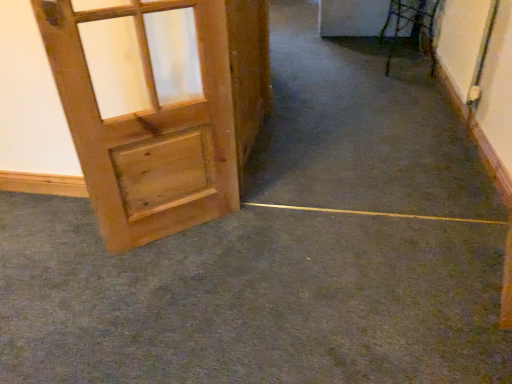
This screenshot has width=512, height=384. Identify the location of green carpet at lower left. (250, 300).

What do you see at coordinates (250, 300) in the screenshot? This screenshot has width=512, height=384. I see `green carpet at lower left` at bounding box center [250, 300].

Locate an element on the screen. Image resolution: width=512 pixels, height=384 pixels. natural wood door at left is located at coordinates (149, 131).

In order to face natural wood door at left, should I rotate leftwards or rightwards?

Turn left by 12.677 degrees to look at natural wood door at left.

The image size is (512, 384). Describe the element at coordinates (149, 131) in the screenshot. I see `natural wood door at left` at that location.

What is the approximate height of natural wood door at left?

The height of natural wood door at left is 94.22 centimeters.

What are the coordinates of `green carpet at lower left` in the screenshot? It's located at (250, 300).

Considering the positions of objects green carpet at lower left and natural wood door at left in the image provided, who is more to the left, green carpet at lower left or natural wood door at left?

natural wood door at left.

In the image, is green carpet at lower left positioned in front of or behind natural wood door at left?

In the image, green carpet at lower left appears in front of natural wood door at left.

Considering the points (14, 195) and (192, 113), which point is behind, point (14, 195) or point (192, 113)?

The point (14, 195) is farther.

From the image's perspective, is green carpet at lower left on natural wood door at left?

No.

From a real-world perspective, is green carpet at lower left under natural wood door at left?

Correct, in the physical world, green carpet at lower left is lower than natural wood door at left.

Is green carpet at lower left wider than natural wood door at left?

Yes, green carpet at lower left is wider than natural wood door at left.

Can you confirm if green carpet at lower left is shorter than natural wood door at left?

Yes.

Consider the image. In terms of size, does green carpet at lower left appear bigger or smaller than natural wood door at left?

green carpet at lower left is bigger than natural wood door at left.

Based on the photo, is green carpet at lower left not inside natural wood door at left?

green carpet at lower left is positioned outside natural wood door at left.

Are green carpet at lower left and natural wood door at left far apart?

No, green carpet at lower left is in close proximity to natural wood door at left.

Could you tell me if green carpet at lower left is turned towards natural wood door at left?

No.

Can you tell me how much green carpet at lower left and natural wood door at left differ in facing direction?

green carpet at lower left and natural wood door at left are facing 41.5 degrees away from each other.

I want to click on door lying above the green carpet at lower left (from the image's perspective), so click(x=149, y=131).

Which object is positioned more to the left, natural wood door at left or green carpet at lower left?

natural wood door at left is more to the left.

Which object is more forward, natural wood door at left or green carpet at lower left?

green carpet at lower left is more forward.

Which is in front, point (76, 140) or point (102, 330)?

Positioned in front is point (102, 330).

From the image's perspective, is natural wood door at left below green carpet at lower left?

Incorrect, from the image's perspective, natural wood door at left is higher than green carpet at lower left.

From a real-world perspective, between natural wood door at left and green carpet at lower left, who is vertically higher?

In real-world perspective, natural wood door at left is above.

Is natural wood door at left wider or thinner than green carpet at lower left?

In the image, natural wood door at left appears to be more narrow than green carpet at lower left.

Considering the sizes of objects natural wood door at left and green carpet at lower left in the image provided, who is shorter, natural wood door at left or green carpet at lower left?

green carpet at lower left.

Does natural wood door at left have a larger size compared to green carpet at lower left?

No, natural wood door at left is not bigger than green carpet at lower left.

Is natural wood door at left not inside green carpet at lower left?

Yes, natural wood door at left is outside of green carpet at lower left.

Is there a large distance between natural wood door at left and green carpet at lower left?

No, there isn't a large distance between natural wood door at left and green carpet at lower left.

Is natural wood door at left facing away from green carpet at lower left?

That's not correct — natural wood door at left is not looking away from green carpet at lower left.

Can you tell me how much natural wood door at left and green carpet at lower left differ in facing direction?

41.5 degrees.

The width and height of the screenshot is (512, 384). What are the coordinates of `door behind the green carpet at lower left` in the screenshot? It's located at (149, 131).

Where is `door on the left side of green carpet at lower left`? The height and width of the screenshot is (384, 512). door on the left side of green carpet at lower left is located at coordinates (149, 131).

Image resolution: width=512 pixels, height=384 pixels. I want to click on concrete in front of the natural wood door at left, so click(x=250, y=300).